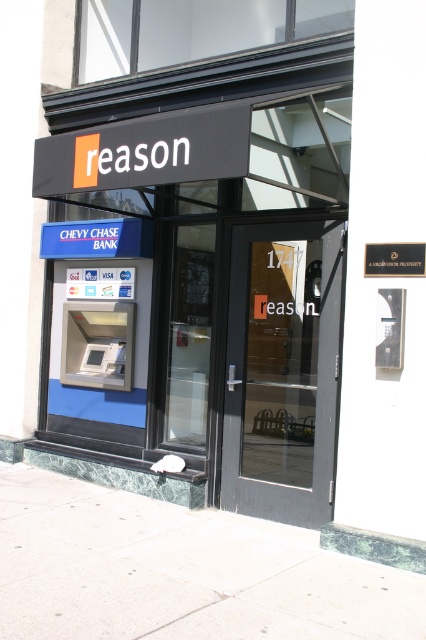
Does metallic atm machine at center have a lesser width compared to gray concrete sidewalk at lower center?

Yes, metallic atm machine at center is thinner than gray concrete sidewalk at lower center.

Who is more distant from viewer, (287, 204) or (160, 516)?

Point (287, 204)

Between point (149, 193) and point (140, 556), which one is positioned in front?

Point (140, 556) is in front.

Identify the location of metallic atm machine at center. (207, 296).

Is point (45, 497) behind point (291, 288)?

Yes.

Locate an element on the screen. Image resolution: width=426 pixels, height=640 pixels. gray concrete sidewalk at lower center is located at coordinates (180, 572).

Locate an element on the screen. gray concrete sidewalk at lower center is located at coordinates (180, 572).

Who is more forward, [60,442] or [330,276]?

Point [330,276] is in front.

At what (x,y) coordinates should I click in order to perform the action: click on metallic atm machine at center. Please return your answer as a coordinate pair (x, y). Image resolution: width=426 pixels, height=640 pixels. Looking at the image, I should click on (207, 296).